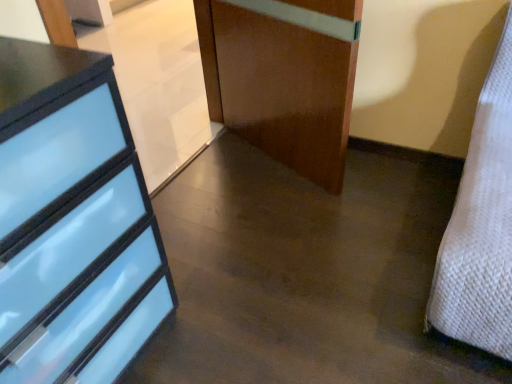
This screenshot has width=512, height=384. Identify the location of free location in front of brown matte door at center. (290, 227).